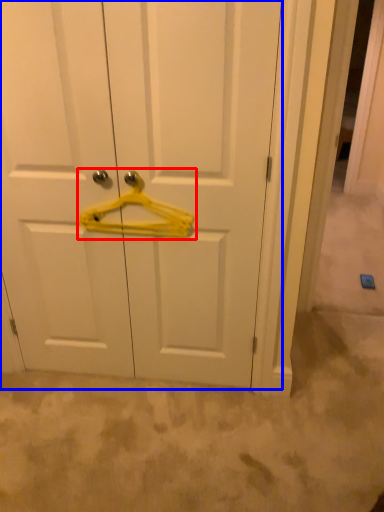
Question: Which of the following is the farthest to the observer, hanger (highlighted by a red box) or door (highlighted by a blue box)?

Choices:
 (A) hanger
 (B) door

Answer: (A)